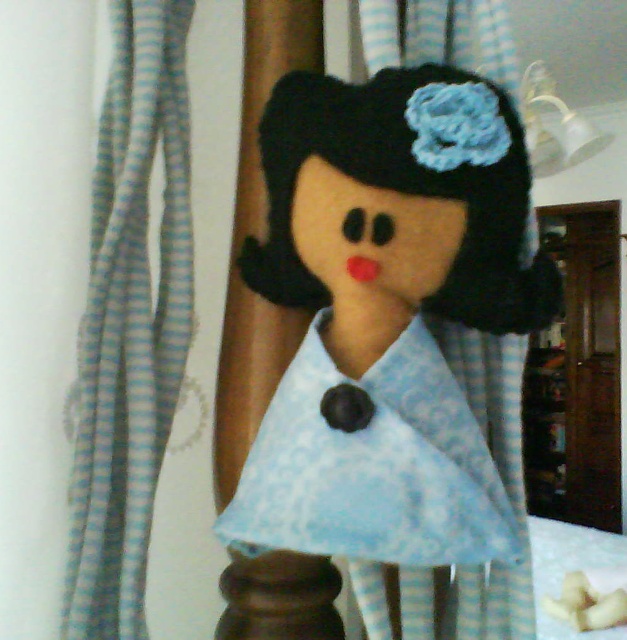
You are a tailor trying to decide whether to use the light blue striped fabric at left to make a new dress for the felt doll at center. Based on their sizes, do you think the fabric is large enough?

The felt doll at center is bigger than the light blue striped fabric at left, so the fabric might not be large enough to create a dress for the doll.

You are a tailor who needs to attach a small ribbon to the felt doll at center so it doesn not touch the light blue striped fabric at left. What is the minimum distance the ribbon should be from the fabric?

The felt doll at center is 13.79 centimeters away from the light blue striped fabric at left. To ensure the ribbon does not touch the fabric, it should be placed at least 13.79 centimeters away from the fabric.

You are an interior designer arranging a nursery. You have a felt doll at center and a light blue striped fabric at left. According to the image, which object is closer to the right edge of the nursery wall?

The felt doll at center is positioned on the right side of the light blue striped fabric at left, so the felt doll at center is closer to the right edge of the nursery wall.